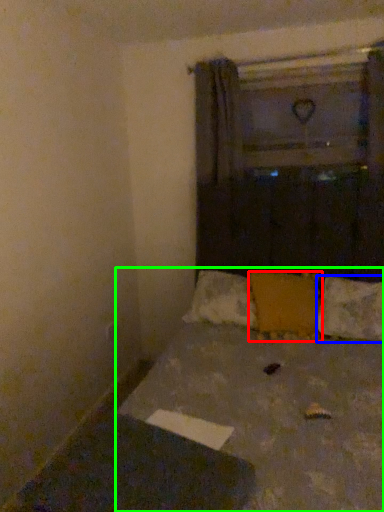
Question: Which object is the farthest from pillow (highlighted by a red box)? Choose among these: pillow (highlighted by a blue box) or bed (highlighted by a green box).

Choices:
 (A) pillow
 (B) bed

Answer: (B)